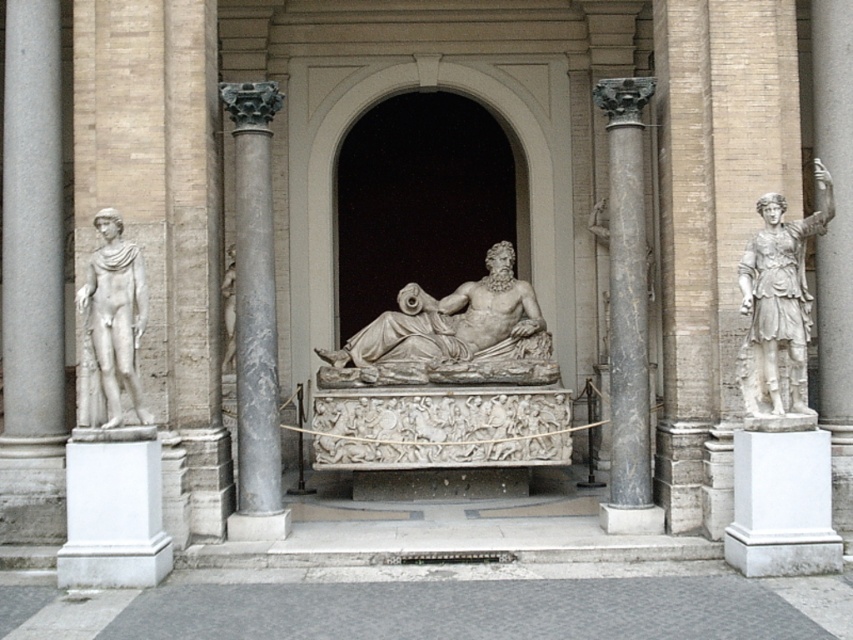
You are an architect designing a new museum exhibit and need to place a 2.5 meter wide sculpture between the gray marble column at center and the black marble column at right. Can you fit it there?

The gray marble column at center is positioned on the left side of black marble column at right, but the distance between them isn t provided. Without knowing the space between the columns, it s impossible to determine if the 2.5 meter wide sculpture will fit.

You are an art conservator assessing the placement of the statues in the classical setting. Given that the white marble statue at right and the white marble statue at left must be positioned symmetrically, does the current height difference between them affect their symmetry?

The white marble statue at right is shorter than the white marble statue at left, which would disrupt the symmetry since symmetrical placement requires both statues to be of equal height.